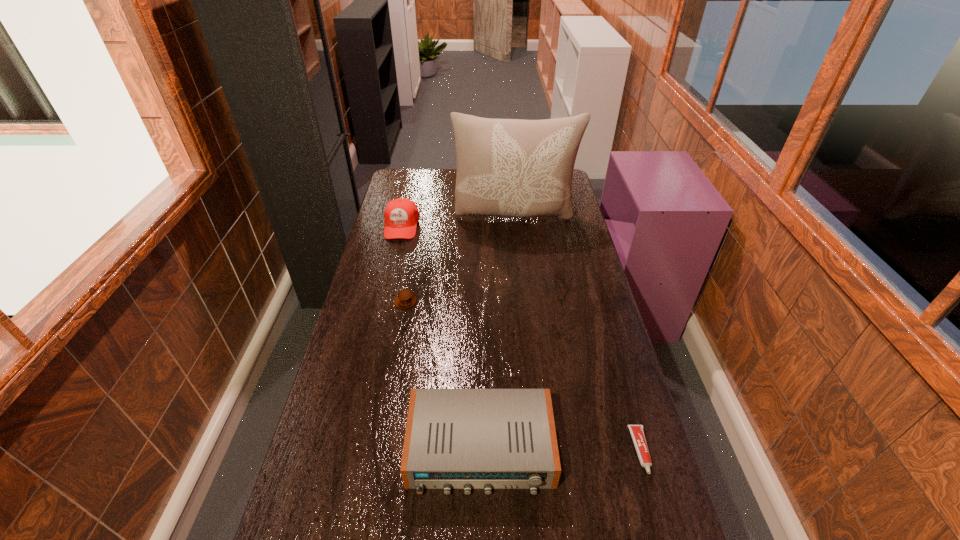
Identify the location of cushion. (518, 168).

I want to click on the second tallest object, so click(401, 215).

Where is `radio receiver`? radio receiver is located at coordinates (467, 439).

Find the location of `the second shortest object`. the second shortest object is located at coordinates (405, 299).

Where is `the third farthest object`? the third farthest object is located at coordinates (405, 299).

You are a GUI agent. You are given a task and a screenshot of the screen. Output one action in this format:
    pyautogui.click(x=<x>, y=<y>)
    Task: Click on the shortest object
    The width and height of the screenshot is (960, 540).
    Given the screenshot: What is the action you would take?
    pyautogui.click(x=637, y=431)

This screenshot has width=960, height=540. I want to click on vacant space located on the front side of the tallest object, so click(523, 299).

Locate an element on the screen. free location located 0.120m on the front panel of the baseball cap is located at coordinates (394, 260).

What are the coordinates of `vacant point located 0.310m on the front of the second shortest object` in the screenshot? It's located at (391, 384).

Find the location of a particular element. free location located at the nozzle of the shortest object is located at coordinates tap(654, 496).